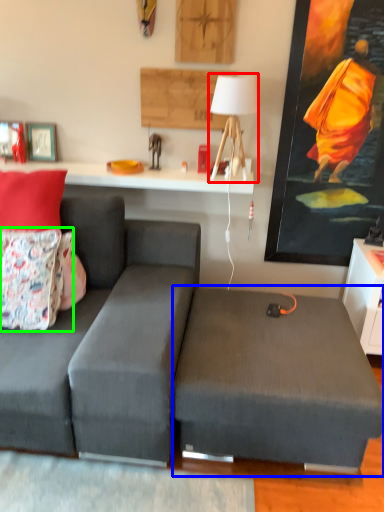
Question: Considering the real-world distances, which object is closest to table lamp (highlighted by a red box)? swivel chair (highlighted by a blue box) or pillow (highlighted by a green box).

Choices:
 (A) swivel chair
 (B) pillow

Answer: (A)